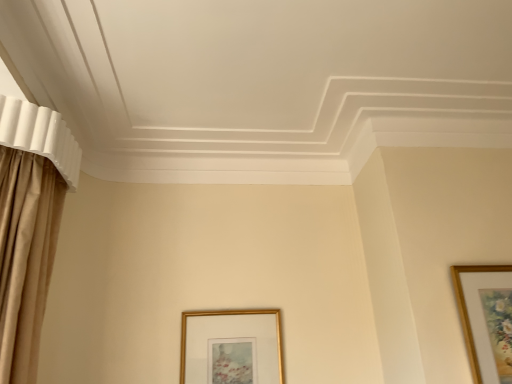
At what (x,y) coordinates should I click in order to perform the action: click on wooden picture frame at upper right, the 2th picture frame viewed from the back. Please return your answer as a coordinate pair (x, y). Looking at the image, I should click on (486, 319).

The width and height of the screenshot is (512, 384). Describe the element at coordinates (486, 319) in the screenshot. I see `wooden picture frame at upper right, which is counted as the 1th picture frame, starting from the front` at that location.

Describe the element at coordinates (231, 347) in the screenshot. I see `gold metallic picture frame at lower center, placed as the first picture frame when sorted from left to right` at that location.

Find the location of a particular element. This screenshot has width=512, height=384. gold metallic picture frame at lower center, which ranks as the 2th picture frame in right-to-left order is located at coordinates (231, 347).

How much space does gold metallic picture frame at lower center, the second picture frame when ordered from front to back, occupy vertically?

It is 11.44 inches.

In order to face gold metallic picture frame at lower center, placed as the first picture frame when sorted from left to right, should I rotate leftwards or rightwards?

Rotate your view left by about 3.150°.

Where is `wooden picture frame at upper right, which is counted as the 1th picture frame, starting from the front`? wooden picture frame at upper right, which is counted as the 1th picture frame, starting from the front is located at coordinates (486, 319).

Based on their positions, is gold metallic picture frame at lower center, placed as the first picture frame when sorted from left to right, located to the left or right of wooden picture frame at upper right, marked as the 2th picture frame in a left-to-right arrangement?

Based on their positions, gold metallic picture frame at lower center, placed as the first picture frame when sorted from left to right, is located to the left of wooden picture frame at upper right, marked as the 2th picture frame in a left-to-right arrangement.

Is gold metallic picture frame at lower center, which ranks as the 2th picture frame in right-to-left order, further to camera compared to wooden picture frame at upper right, marked as the 2th picture frame in a left-to-right arrangement?

Yes, gold metallic picture frame at lower center, which ranks as the 2th picture frame in right-to-left order, is behind wooden picture frame at upper right, marked as the 2th picture frame in a left-to-right arrangement.

Between point (250, 356) and point (500, 278), which one is positioned in front?

The point (500, 278) is closer.

From the image's perspective, which is below, gold metallic picture frame at lower center, placed as the first picture frame when sorted from left to right, or wooden picture frame at upper right, which is counted as the 1th picture frame, starting from the front?

From the image's view, gold metallic picture frame at lower center, placed as the first picture frame when sorted from left to right, is below.

From a real-world perspective, who is located lower, gold metallic picture frame at lower center, which ranks as the 2th picture frame in right-to-left order, or wooden picture frame at upper right, which is counted as the 1th picture frame, starting from the front?

gold metallic picture frame at lower center, which ranks as the 2th picture frame in right-to-left order, from a real-world perspective.

Which object is thinner, gold metallic picture frame at lower center, the second picture frame when ordered from front to back, or wooden picture frame at upper right, the 2th picture frame viewed from the back?

Thinner between the two is gold metallic picture frame at lower center, the second picture frame when ordered from front to back.

Is gold metallic picture frame at lower center, the second picture frame when ordered from front to back, taller or shorter than wooden picture frame at upper right, marked as the 2th picture frame in a left-to-right arrangement?

In the image, gold metallic picture frame at lower center, the second picture frame when ordered from front to back, appears to be shorter than wooden picture frame at upper right, marked as the 2th picture frame in a left-to-right arrangement.

Considering the relative sizes of gold metallic picture frame at lower center, the first picture frame in the back-to-front sequence, and wooden picture frame at upper right, the 2th picture frame viewed from the back, in the image provided, is gold metallic picture frame at lower center, the first picture frame in the back-to-front sequence, smaller than wooden picture frame at upper right, the 2th picture frame viewed from the back,?

Yes.

Is gold metallic picture frame at lower center, which ranks as the 2th picture frame in right-to-left order, outside of wooden picture frame at upper right, marked as the 2th picture frame in a left-to-right arrangement?

Indeed, gold metallic picture frame at lower center, which ranks as the 2th picture frame in right-to-left order, is completely outside wooden picture frame at upper right, marked as the 2th picture frame in a left-to-right arrangement.

Would you say gold metallic picture frame at lower center, the first picture frame in the back-to-front sequence, is a long distance from wooden picture frame at upper right, which is counted as the 1th picture frame, starting from the front?

No, there isn't a large distance between gold metallic picture frame at lower center, the first picture frame in the back-to-front sequence, and wooden picture frame at upper right, which is counted as the 1th picture frame, starting from the front.

Does gold metallic picture frame at lower center, placed as the first picture frame when sorted from left to right, turn towards wooden picture frame at upper right, marked as the 2th picture frame in a left-to-right arrangement?

No, gold metallic picture frame at lower center, placed as the first picture frame when sorted from left to right, is not oriented towards wooden picture frame at upper right, marked as the 2th picture frame in a left-to-right arrangement.

Where is `picture frame on the right of gold metallic picture frame at lower center, the first picture frame in the back-to-front sequence`? The width and height of the screenshot is (512, 384). picture frame on the right of gold metallic picture frame at lower center, the first picture frame in the back-to-front sequence is located at coordinates (486, 319).

Can you confirm if wooden picture frame at upper right, which is counted as the 1th picture frame, starting from the front, is positioned to the left of gold metallic picture frame at lower center, placed as the first picture frame when sorted from left to right?

No, wooden picture frame at upper right, which is counted as the 1th picture frame, starting from the front, is not to the left of gold metallic picture frame at lower center, placed as the first picture frame when sorted from left to right.

Is wooden picture frame at upper right, marked as the 2th picture frame in a left-to-right arrangement, closer to the viewer compared to gold metallic picture frame at lower center, which ranks as the 2th picture frame in right-to-left order?

Yes, the depth of wooden picture frame at upper right, marked as the 2th picture frame in a left-to-right arrangement, is less than that of gold metallic picture frame at lower center, which ranks as the 2th picture frame in right-to-left order.

Is point (502, 379) behind point (206, 335)?

That is False.

From the image's perspective, is wooden picture frame at upper right, which ranks as the first picture frame in right-to-left order, beneath gold metallic picture frame at lower center, which ranks as the 2th picture frame in right-to-left order?

Actually, wooden picture frame at upper right, which ranks as the first picture frame in right-to-left order, appears above gold metallic picture frame at lower center, which ranks as the 2th picture frame in right-to-left order, in the image.

From a real-world perspective, which is physically below, wooden picture frame at upper right, which is counted as the 1th picture frame, starting from the front, or gold metallic picture frame at lower center, which ranks as the 2th picture frame in right-to-left order?

gold metallic picture frame at lower center, which ranks as the 2th picture frame in right-to-left order, from a real-world perspective.

Which object is wider, wooden picture frame at upper right, marked as the 2th picture frame in a left-to-right arrangement, or gold metallic picture frame at lower center, the second picture frame when ordered from front to back?

wooden picture frame at upper right, marked as the 2th picture frame in a left-to-right arrangement, is wider.

Considering the relative sizes of wooden picture frame at upper right, which is counted as the 1th picture frame, starting from the front, and gold metallic picture frame at lower center, the second picture frame when ordered from front to back, in the image provided, is wooden picture frame at upper right, which is counted as the 1th picture frame, starting from the front, taller than gold metallic picture frame at lower center, the second picture frame when ordered from front to back,?

Indeed, wooden picture frame at upper right, which is counted as the 1th picture frame, starting from the front, has a greater height compared to gold metallic picture frame at lower center, the second picture frame when ordered from front to back.

Is wooden picture frame at upper right, the 2th picture frame viewed from the back, bigger or smaller than gold metallic picture frame at lower center, which ranks as the 2th picture frame in right-to-left order?

In the image, wooden picture frame at upper right, the 2th picture frame viewed from the back, appears to be larger than gold metallic picture frame at lower center, which ranks as the 2th picture frame in right-to-left order.

Is gold metallic picture frame at lower center, the first picture frame in the back-to-front sequence, surrounded by wooden picture frame at upper right, the 2th picture frame viewed from the back?

No, gold metallic picture frame at lower center, the first picture frame in the back-to-front sequence, is located outside of wooden picture frame at upper right, the 2th picture frame viewed from the back.

Are wooden picture frame at upper right, which ranks as the first picture frame in right-to-left order, and gold metallic picture frame at lower center, the second picture frame when ordered from front to back, far apart?

That's not correct — wooden picture frame at upper right, which ranks as the first picture frame in right-to-left order, is a little close to gold metallic picture frame at lower center, the second picture frame when ordered from front to back.

Is wooden picture frame at upper right, marked as the 2th picture frame in a left-to-right arrangement, aimed at gold metallic picture frame at lower center, the second picture frame when ordered from front to back?

No, wooden picture frame at upper right, marked as the 2th picture frame in a left-to-right arrangement, is not turned towards gold metallic picture frame at lower center, the second picture frame when ordered from front to back.

In the scene shown: How different are the orientations of wooden picture frame at upper right, which ranks as the first picture frame in right-to-left order, and gold metallic picture frame at lower center, which ranks as the 2th picture frame in right-to-left order, in degrees?

There is a 0.00561-degree angle between the facing directions of wooden picture frame at upper right, which ranks as the first picture frame in right-to-left order, and gold metallic picture frame at lower center, which ranks as the 2th picture frame in right-to-left order.

Where is `picture frame located behind the wooden picture frame at upper right, the 2th picture frame viewed from the back`? The width and height of the screenshot is (512, 384). picture frame located behind the wooden picture frame at upper right, the 2th picture frame viewed from the back is located at coordinates (231, 347).

The width and height of the screenshot is (512, 384). What are the coordinates of `picture frame in front of the gold metallic picture frame at lower center, the second picture frame when ordered from front to back` in the screenshot? It's located at (486, 319).

Locate an element on the screen. picture frame above the gold metallic picture frame at lower center, the second picture frame when ordered from front to back (from a real-world perspective) is located at coordinates pyautogui.click(x=486, y=319).